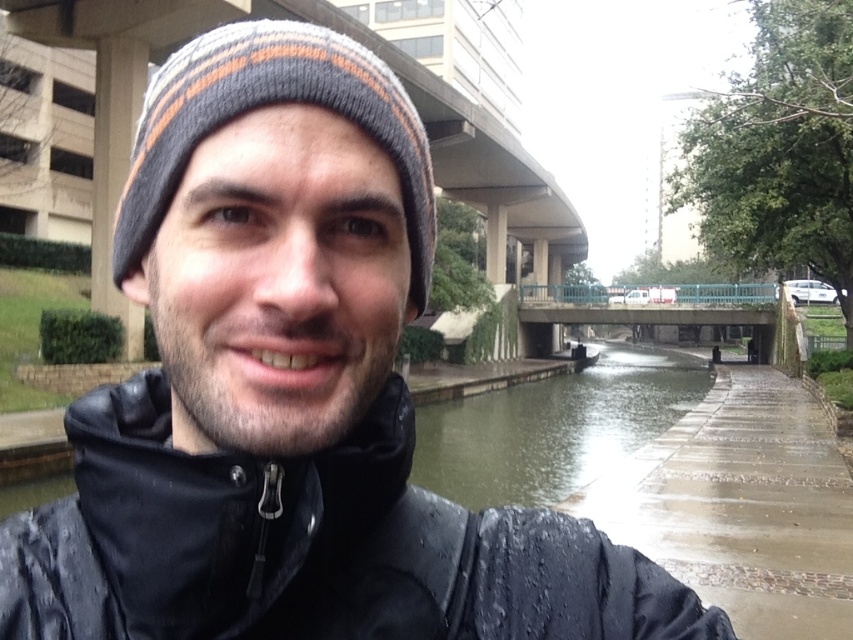
Is waterproof black jacket at center above knit woolen beanie at center?

Actually, waterproof black jacket at center is below knit woolen beanie at center.

Does waterproof black jacket at center have a greater height compared to knit woolen beanie at center?

No.

Identify the location of waterproof black jacket at center. This screenshot has width=853, height=640. (308, 547).

Locate an element on the screen. This screenshot has width=853, height=640. waterproof black jacket at center is located at coordinates (308, 547).

Who is higher up, knit woolen beanie at center or greenish concrete river at center?

knit woolen beanie at center

Describe the element at coordinates (265, 106) in the screenshot. The image size is (853, 640). I see `knit woolen beanie at center` at that location.

At what (x,y) coordinates should I click in order to perform the action: click on knit woolen beanie at center. Please return your answer as a coordinate pair (x, y). The image size is (853, 640). Looking at the image, I should click on (265, 106).

Is the position of waterproof black jacket at center less distant than that of greenish concrete river at center?

Yes, waterproof black jacket at center is in front of greenish concrete river at center.

Is waterproof black jacket at center bigger than greenish concrete river at center?

No.

Does point (392, 461) come closer to viewer compared to point (612, 404)?

That is True.

Find the location of `waterproof black jacket at center`. waterproof black jacket at center is located at coordinates (308, 547).